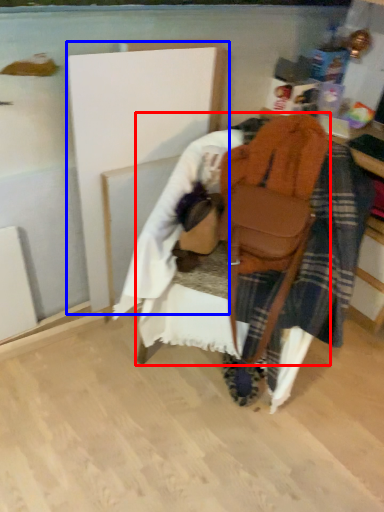
Question: Among these objects, which one is farthest to the camera, furniture (highlighted by a red box) or wood (highlighted by a blue box)?

Choices:
 (A) furniture
 (B) wood

Answer: (B)